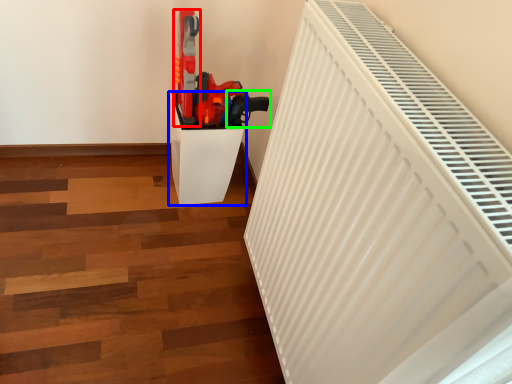
Question: Which is farther away from equipment (highlighted by a red box)? furniture (highlighted by a blue box) or weapon (highlighted by a green box)?

Choices:
 (A) furniture
 (B) weapon

Answer: (B)